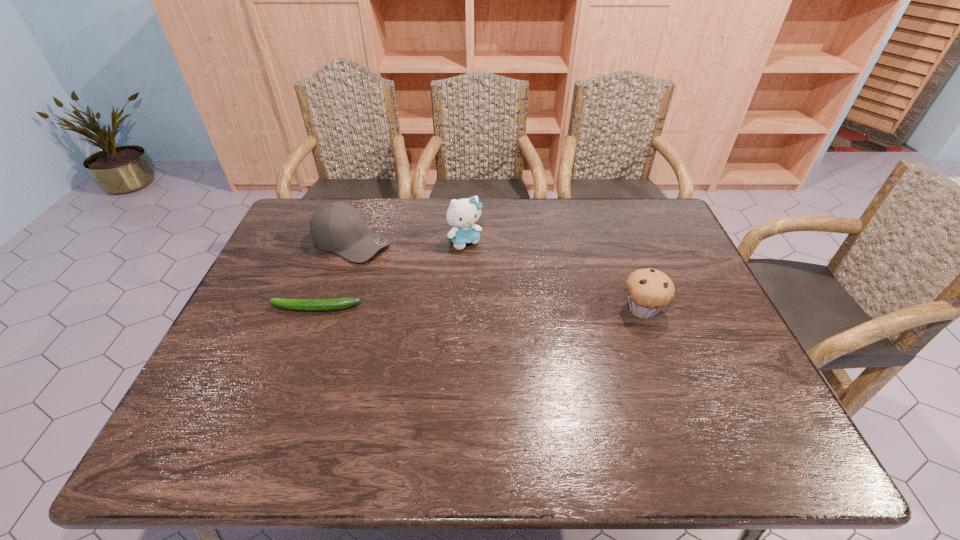
In order to click on vacant spot on the desktop that is between the shortest object and the rightmost object and is positioned on the face of the tallest object in this screenshot , I will do `click(519, 309)`.

Image resolution: width=960 pixels, height=540 pixels. What are the coordinates of `vacant spot on the desktop that is between the shortest object and the rightmost object and is positioned on the front brim of the baseball cap` in the screenshot? It's located at (497, 309).